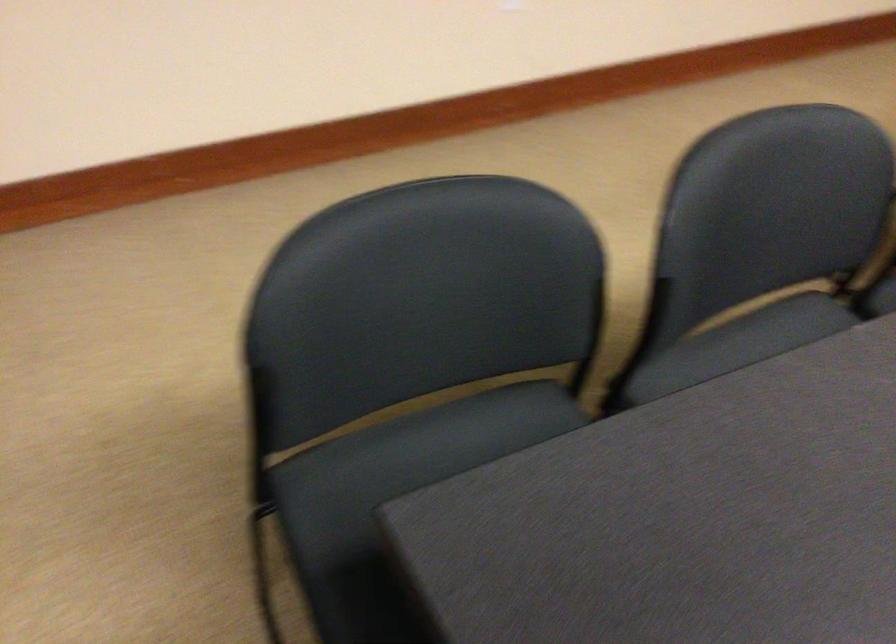
This screenshot has height=644, width=896. I want to click on black chair sitting surface, so click(x=416, y=449).